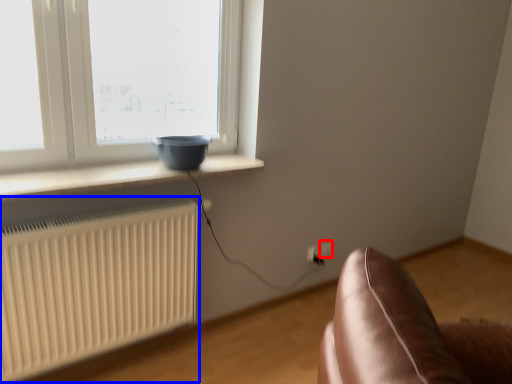
Question: Which object appears farthest to the camera in this image, electric outlet (highlighted by a red box) or radiator (highlighted by a blue box)?

Choices:
 (A) electric outlet
 (B) radiator

Answer: (A)